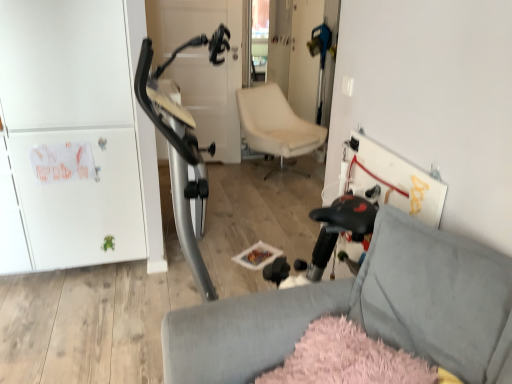
Question: From the image's perspective, is beige leather chair at center, arranged as the 1th chair when viewed from the back, below white matte cabinet at left?

Choices:
 (A) yes
 (B) no

Answer: (B)

Question: Does beige leather chair at center, the second chair in the bottom-to-top sequence, have a greater width compared to white matte cabinet at left?

Choices:
 (A) yes
 (B) no

Answer: (B)

Question: Is beige leather chair at center, arranged as the 1th chair when viewed from the back, further to camera compared to white matte cabinet at left?

Choices:
 (A) no
 (B) yes

Answer: (B)

Question: Considering the relative sizes of beige leather chair at center, arranged as the 1th chair when viewed from the back, and white matte cabinet at left in the image provided, is beige leather chair at center, arranged as the 1th chair when viewed from the back, bigger than white matte cabinet at left?

Choices:
 (A) yes
 (B) no

Answer: (B)

Question: Is beige leather chair at center, which is the first chair in top-to-bottom order, thinner than white matte cabinet at left?

Choices:
 (A) yes
 (B) no

Answer: (A)

Question: Which is correct: soft gray fabric chair at lower right, which is the first chair in front-to-back order, is inside beige leather chair at center, arranged as the 1th chair when viewed from the back, or outside of it?

Choices:
 (A) outside
 (B) inside

Answer: (A)

Question: Visually, is soft gray fabric chair at lower right, which appears as the second chair when viewed from the back, positioned to the left or to the right of beige leather chair at center, the second chair in the bottom-to-top sequence?

Choices:
 (A) right
 (B) left

Answer: (B)

Question: From a real-world perspective, is soft gray fabric chair at lower right, which is the first chair in front-to-back order, above or below beige leather chair at center, the second chair in the bottom-to-top sequence?

Choices:
 (A) below
 (B) above

Answer: (B)

Question: Relative to beige leather chair at center, which is the first chair in top-to-bottom order, is soft gray fabric chair at lower right, which is the first chair in front-to-back order, in front or behind?

Choices:
 (A) front
 (B) behind

Answer: (A)

Question: Is white matte cabinet at left bigger or smaller than soft gray fabric chair at lower right, which appears as the second chair when viewed from the back?

Choices:
 (A) big
 (B) small

Answer: (A)

Question: From the image's perspective, relative to soft gray fabric chair at lower right, which appears as the second chair when viewed from the back, is white matte cabinet at left above or below?

Choices:
 (A) below
 (B) above

Answer: (B)

Question: From a real-world perspective, is white matte cabinet at left above or below soft gray fabric chair at lower right, the 1th chair from the bottom?

Choices:
 (A) below
 (B) above

Answer: (B)

Question: Considering the relative positions of white matte cabinet at left and soft gray fabric chair at lower right, which appears as the second chair when viewed from the back, in the image provided, is white matte cabinet at left to the left or to the right of soft gray fabric chair at lower right, which appears as the second chair when viewed from the back,?

Choices:
 (A) right
 (B) left

Answer: (B)

Question: Is point (96, 148) positioned closer to the camera than point (238, 102)?

Choices:
 (A) farther
 (B) closer

Answer: (B)

Question: Is white matte cabinet at left in front of or behind beige leather chair at center, which is the first chair in top-to-bottom order, in the image?

Choices:
 (A) front
 (B) behind

Answer: (A)